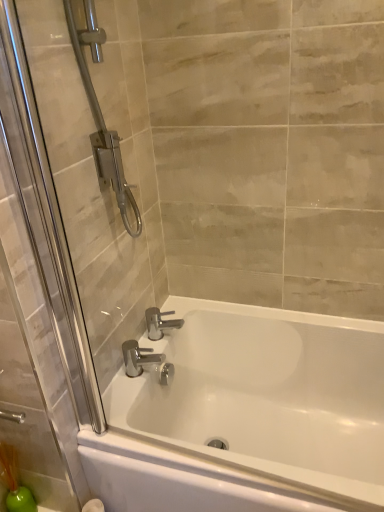
Question: Considering the relative positions of polished chrome faucet at lower center, which appears as the 1th tap when viewed from the front, and white glossy bathtub at center in the image provided, is polished chrome faucet at lower center, which appears as the 1th tap when viewed from the front, to the left or to the right of white glossy bathtub at center?

Choices:
 (A) left
 (B) right

Answer: (A)

Question: Is polished chrome faucet at lower center, which appears as the 1th tap when viewed from the front, wider or thinner than white glossy bathtub at center?

Choices:
 (A) thin
 (B) wide

Answer: (A)

Question: Which of these objects is positioned farthest from the chrome metallic faucet at center, placed as the first tap when sorted from back to front?

Choices:
 (A) polished chrome faucet at lower center, which appears as the 1th tap when viewed from the front
 (B) white glossy bathtub at center

Answer: (B)

Question: Considering the real-world distances, which object is closest to the white glossy bathtub at center?

Choices:
 (A) chrome metallic faucet at center, placed as the first tap when sorted from back to front
 (B) polished chrome faucet at lower center, the second tap from the back

Answer: (B)